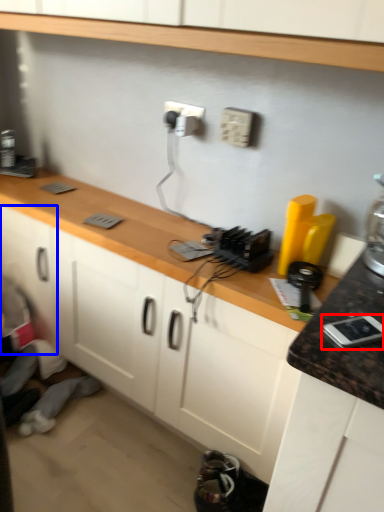
Question: Which point is further to the camera, appliance (highlighted by a red box) or cabinetry (highlighted by a blue box)?

Choices:
 (A) appliance
 (B) cabinetry

Answer: (B)